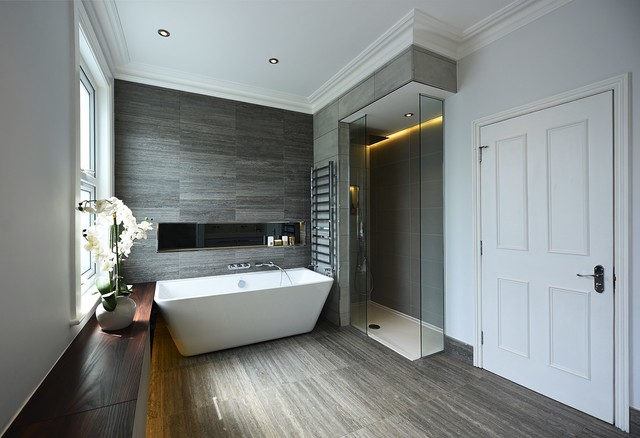
The height and width of the screenshot is (438, 640). I want to click on floor in bathroom, so (x=321, y=396).